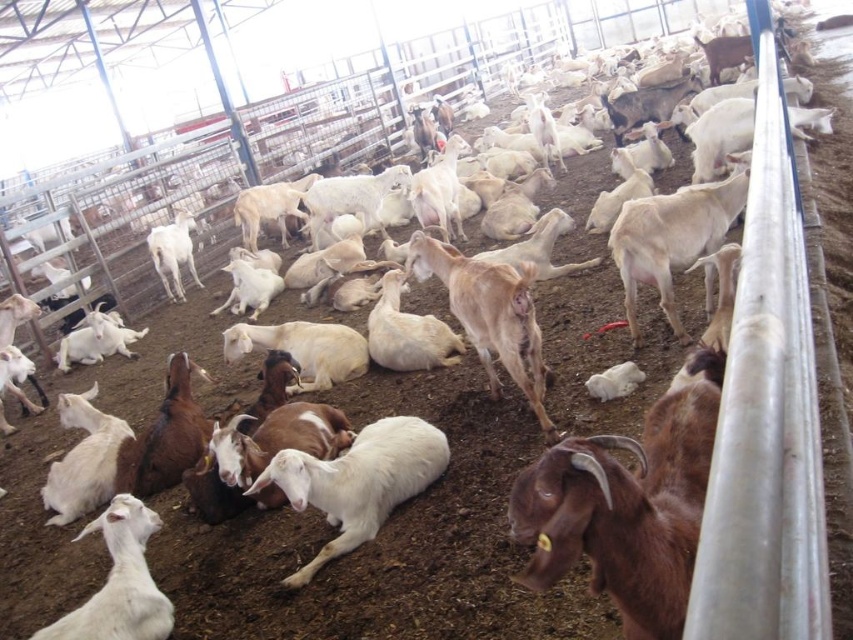
You are a farmer checking the enclosure. You see the brown fuzzy goat at lower right and the white woolen goat at lower left. Which goat is positioned more to the right side of the enclosure?

The brown fuzzy goat at lower right is positioned more to the right side of the enclosure compared to the white woolen goat at lower left.

You are a farmer who needs to place a new feeding trough in the enclosure. You have two points marked on the enclosure map at coordinates point (590, 456) and point (328, 557). Which point is closer to the front of the enclosure where you want to place the trough?

Point (590, 456) is in front of point (328, 557), so the feeding trough should be placed at point (590, 456) as it is closer to the front of the enclosure.

You are a farmer who needs to check the distance between the brown fuzzy goat at lower right and the closest fence. Can you determine if the distance is more than 4 feet?

The distance between the brown fuzzy goat at lower right and the closest fence is 4.23 feet, which is more than 4 feet. Therefore, the distance is sufficient.